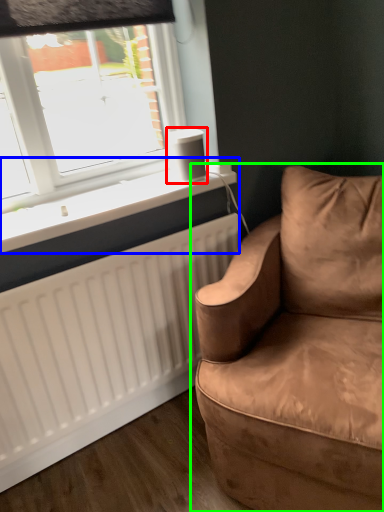
Question: Which object is positioned closest to speaker (highlighted by a red box)? Select from window sill (highlighted by a blue box) and studio couch (highlighted by a green box).

Choices:
 (A) window sill
 (B) studio couch

Answer: (A)